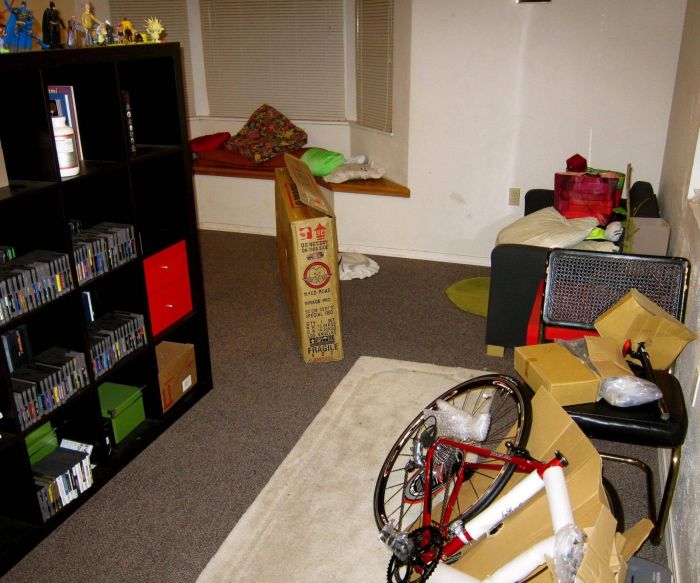
Identify the location of white rug. (326, 516).